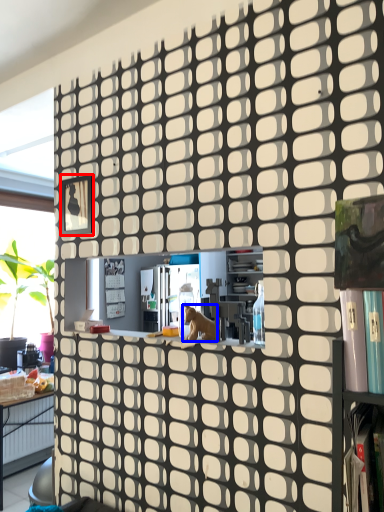
Question: Which object is further to the camera taking this photo, square (highlighted by a red box) or animal (highlighted by a blue box)?

Choices:
 (A) square
 (B) animal

Answer: (A)